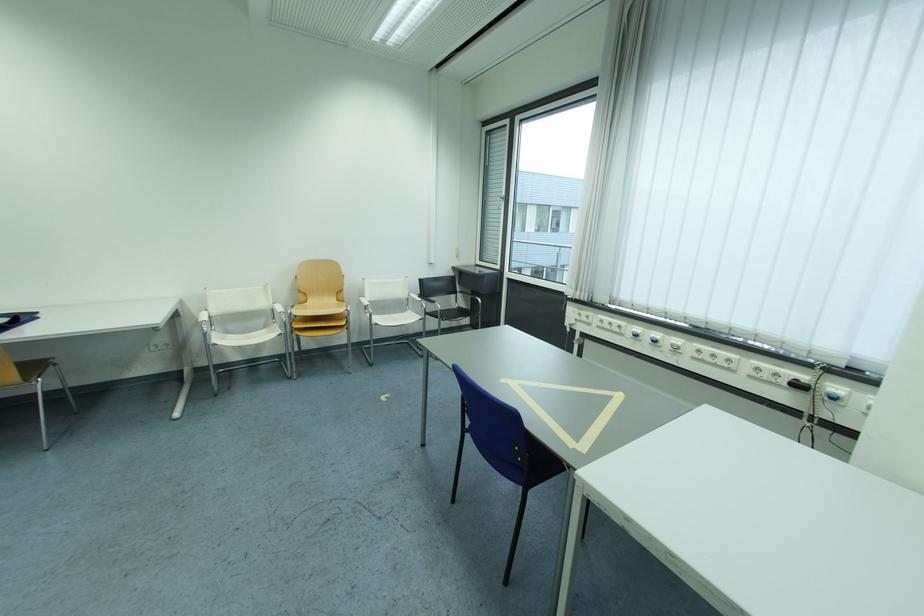
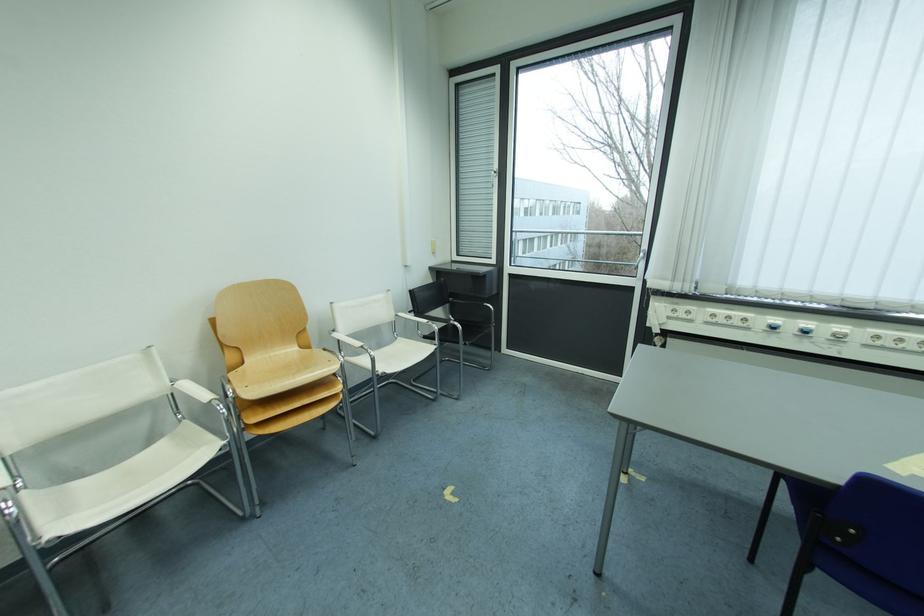
Where in the second image is the point corresponding to pixel 429 283 from the first image?

(419, 294)